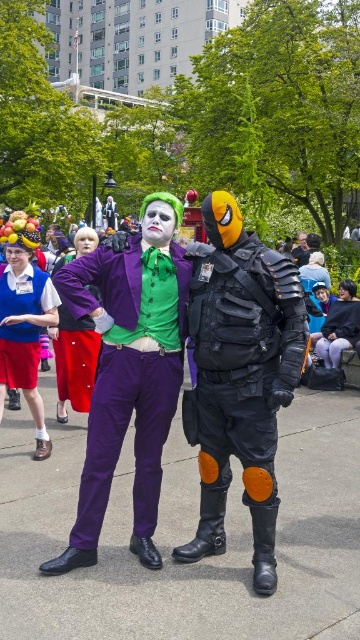
You are a costume designer observing the Joker character in the image. You notice two key costume elements at the center of the image. Which one is bigger in size between the purple matte pants at center and the matte blue vest at center?

The purple matte pants at center is larger in size than the matte blue vest at center.

You are a photographer at the event and want to capture a photo that includes the matte blue vest at center. Where should you position yourself relative to the other objects in the scene to ensure the vest is centered in your shot?

To center the matte blue vest at center in your photo, position yourself directly facing the point at coordinates [24,317] where the vest is located.